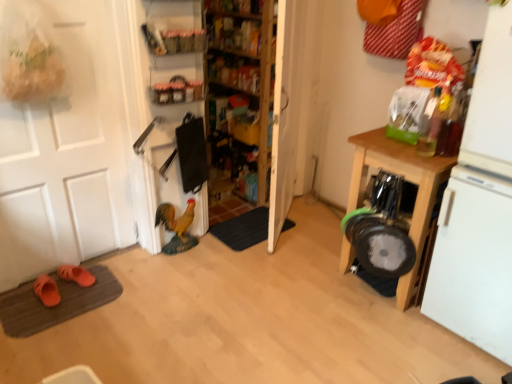
What are the coordinates of `brown textured doormat at lower left, positioned as the 2th doormat in back-to-front order` in the screenshot? It's located at (56, 305).

Image resolution: width=512 pixels, height=384 pixels. Describe the element at coordinates (177, 91) in the screenshot. I see `matte plastic shelf at upper center, which ranks as the second shelf in back-to-front order` at that location.

What do you see at coordinates (47, 290) in the screenshot? I see `orange rubber slippers at lower left, acting as the 2th footwear starting from the back` at bounding box center [47, 290].

Identify the location of wooden cutting board at right. The image size is (512, 384). (415, 198).

Which shelf is the 2nd one when counting from the right side of the matte plastic shelf at upper center, the 2th shelf when ordered from front to back? Please provide its 2D coordinates.

[(242, 87)]

Considering the relative positions of matte plastic shelf at upper center, the 2th shelf when ordered from front to back, and wooden shelves at center, which is the 1th shelf from back to front, in the image provided, is matte plastic shelf at upper center, the 2th shelf when ordered from front to back, in front of wooden shelves at center, which is the 1th shelf from back to front,?

Yes, matte plastic shelf at upper center, the 2th shelf when ordered from front to back, is in front of wooden shelves at center, which is the 1th shelf from back to front.

Does matte plastic shelf at upper center, which ranks as the second shelf in back-to-front order, turn towards wooden shelves at center, which is the third shelf from front to back?

No, matte plastic shelf at upper center, which ranks as the second shelf in back-to-front order, is not oriented towards wooden shelves at center, which is the third shelf from front to back.

Which of these two, matte plastic shelf at upper center, the 2th shelf when ordered from front to back, or wooden shelves at center, which is the 1th shelf from back to front, is wider?

wooden shelves at center, which is the 1th shelf from back to front.

What's the angular difference between white matte door at left and brown textured doormat at lower left, arranged as the 2th doormat when viewed from the top,'s facing directions?

The facing directions of white matte door at left and brown textured doormat at lower left, arranged as the 2th doormat when viewed from the top, are 0.6 degrees apart.

Locate an element on the screen. The width and height of the screenshot is (512, 384). door located in front of the brown textured doormat at lower left, arranged as the 2th doormat when viewed from the top is located at coordinates (67, 154).

Considering the relative positions of white matte door at left and brown textured doormat at lower left, positioned as the first doormat in front-to-back order, in the image provided, is white matte door at left to the left of brown textured doormat at lower left, positioned as the first doormat in front-to-back order, from the viewer's perspective?

Incorrect, white matte door at left is not on the left side of brown textured doormat at lower left, positioned as the first doormat in front-to-back order.

Is brown textured doormat at lower left, the 1th doormat when ordered from bottom to top, completely or partially inside white matte door at left?

No, brown textured doormat at lower left, the 1th doormat when ordered from bottom to top, is not a part of white matte door at left.

From a real-world perspective, which is physically above, wooden shelves at center, which is the 1th shelf from back to front, or brown textured doormat at lower left, which is the 1th doormat from left to right?

wooden shelves at center, which is the 1th shelf from back to front, from a real-world perspective.

Which object is more forward, wooden shelves at center, which is the third shelf from front to back, or brown textured doormat at lower left, positioned as the 2th doormat in back-to-front order?

brown textured doormat at lower left, positioned as the 2th doormat in back-to-front order, is in front.

Based on the photo, is wooden shelves at center, which is the 1th shelf from back to front, positioned far away from brown textured doormat at lower left, which is the 1th doormat from left to right?

wooden shelves at center, which is the 1th shelf from back to front, is positioned a significant distance from brown textured doormat at lower left, which is the 1th doormat from left to right.

What are the coordinates of `shelf that is the 1st object located above the brown textured doormat at lower left, positioned as the first doormat in front-to-back order (from the image's perspective)` in the screenshot? It's located at (242, 87).

Can we say white matte door at left lies outside orange rubber slippers at lower left, positioned as the first footwear in front-to-back order?

white matte door at left lies outside orange rubber slippers at lower left, positioned as the first footwear in front-to-back order,'s area.

Considering the positions of objects white matte door at left and orange rubber slippers at lower left, positioned as the first footwear in front-to-back order, in the image provided, who is more to the left, white matte door at left or orange rubber slippers at lower left, positioned as the first footwear in front-to-back order,?

orange rubber slippers at lower left, positioned as the first footwear in front-to-back order.

Considering the relative sizes of white matte door at left and orange rubber slippers at lower left, acting as the 2th footwear starting from the back, in the image provided, is white matte door at left taller than orange rubber slippers at lower left, acting as the 2th footwear starting from the back,?

Indeed, white matte door at left has a greater height compared to orange rubber slippers at lower left, acting as the 2th footwear starting from the back.

From a real-world perspective, does white matte door at left sit lower than orange rubber slippers at lower left, positioned as the first footwear in front-to-back order?

Actually, white matte door at left is physically above orange rubber slippers at lower left, positioned as the first footwear in front-to-back order, in the real world.

Based on the photo, which is more to the left, orange suede slippers at lower left, the 1th footwear viewed from the back, or white matte door at left?

white matte door at left is more to the left.

From the image's perspective, relative to white matte door at left, is orange suede slippers at lower left, which is the 2th footwear from front to back, above or below?

orange suede slippers at lower left, which is the 2th footwear from front to back, is situated lower than white matte door at left in the image.

From a real-world perspective, which footwear is the 2nd one underneath the white matte door at left? Please provide its 2D coordinates.

[(76, 274)]

Does wooden cutting board at right lie in front of white matte door at left?

No, it is behind white matte door at left.

Considering the relative positions of wooden cutting board at right and white matte door at left in the image provided, is wooden cutting board at right to the left or to the right of white matte door at left?

Based on their positions, wooden cutting board at right is located to the right of white matte door at left.

What are the coordinates of `cabinetry on the right of white matte door at left` in the screenshot? It's located at (415, 198).

Is there a large distance between wooden cutting board at right and white matte door at left?

Yes, wooden cutting board at right and white matte door at left are located far from each other.

Is dark gray carpet at center, which ranks as the second doormat in front-to-back order, at the right side of wooden shelves at center, which is the third shelf from front to back?

Incorrect, dark gray carpet at center, which ranks as the second doormat in front-to-back order, is not on the right side of wooden shelves at center, which is the third shelf from front to back.

Considering the sizes of objects dark gray carpet at center, which ranks as the second doormat in front-to-back order, and wooden shelves at center, which is the 1th shelf from back to front, in the image provided, who is taller, dark gray carpet at center, which ranks as the second doormat in front-to-back order, or wooden shelves at center, which is the 1th shelf from back to front,?

Standing taller between the two is wooden shelves at center, which is the 1th shelf from back to front.

Is dark gray carpet at center, marked as the first doormat in a right-to-left arrangement, aimed at wooden shelves at center, which is the third shelf from front to back?

No, dark gray carpet at center, marked as the first doormat in a right-to-left arrangement, is not aimed at wooden shelves at center, which is the third shelf from front to back.

Locate an element on the screen. This screenshot has width=512, height=384. the 1st shelf positioned above the wooden shelves at center, which is the 1th shelf from back to front (from a real-world perspective) is located at coordinates (177, 91).

You are a GUI agent. You are given a task and a screenshot of the screen. Output one action in this format:
    pyautogui.click(x=<x>, y=<y>)
    Task: Click on the door lying in front of the brown textured doormat at lower left, acting as the 2th doormat starting from the right
    The width and height of the screenshot is (512, 384).
    Given the screenshot: What is the action you would take?
    pyautogui.click(x=67, y=154)

Which object lies further to the anchor point orange rubber slippers at lower left, acting as the 2th footwear starting from the back, brown textured doormat at lower left, which is the 1th doormat from left to right, or wooden cutting board at right?

wooden cutting board at right lies further to orange rubber slippers at lower left, acting as the 2th footwear starting from the back, than the other object.

Considering their positions, is wooden cutting board at right positioned further to dark gray carpet at center, placed as the first doormat when sorted from back to front, than matte plastic shelf at upper center, which is counted as the 3th shelf, starting from the back?

The object further to dark gray carpet at center, placed as the first doormat when sorted from back to front, is matte plastic shelf at upper center, which is counted as the 3th shelf, starting from the back.

Which object lies nearer to the anchor point orange suede slippers at lower left, which is the 2th footwear from front to back, brown textured doormat at lower left, arranged as the 2th doormat when viewed from the top, or dark gray carpet at center, placed as the 2th doormat when sorted from bottom to top?

brown textured doormat at lower left, arranged as the 2th doormat when viewed from the top, is closer to orange suede slippers at lower left, which is the 2th footwear from front to back.

From the image, which object appears to be nearer to brown textured doormat at lower left, positioned as the first doormat in front-to-back order, dark gray carpet at center, which is the 2th doormat from left to right, or matte plastic shelf at upper center, which is counted as the 3th shelf, starting from the back?

dark gray carpet at center, which is the 2th doormat from left to right, is closer to brown textured doormat at lower left, positioned as the first doormat in front-to-back order.

Which object lies nearer to the anchor point dark gray carpet at center, placed as the 2th doormat when sorted from bottom to top, matte plastic shelf at upper center, which ranks as the first shelf in front-to-back order, or wooden shelves at center, which is the third shelf from front to back?

wooden shelves at center, which is the third shelf from front to back, lies closer to dark gray carpet at center, placed as the 2th doormat when sorted from bottom to top, than the other object.

Looking at the image, which one is located further to matte plastic shelf at upper center, which is counted as the 3th shelf, starting from the back, wooden cutting board at right or orange rubber slippers at lower left, acting as the 2th footwear starting from the back?

orange rubber slippers at lower left, acting as the 2th footwear starting from the back, lies further to matte plastic shelf at upper center, which is counted as the 3th shelf, starting from the back, than the other object.

Based on their spatial positions, is white matte door at left or wooden cutting board at right further from white matte refrigerator at right?

white matte door at left.

Looking at the image, which one is located further to white matte refrigerator at right, matte plastic shelf at upper center, which ranks as the first shelf in front-to-back order, or orange suede slippers at lower left, the 1th footwear viewed from the back?

Based on the image, orange suede slippers at lower left, the 1th footwear viewed from the back, appears to be further to white matte refrigerator at right.

I want to click on doormat located between brown textured doormat at lower left, the 1th doormat when ordered from bottom to top, and white matte refrigerator at right in the left-right direction, so click(243, 229).

You are a GUI agent. You are given a task and a screenshot of the screen. Output one action in this format:
    pyautogui.click(x=<x>, y=<y>)
    Task: Click on the doormat between orange suede slippers at lower left, which is the 2th footwear from front to back, and white matte refrigerator at right from left to right
    
    Given the screenshot: What is the action you would take?
    pyautogui.click(x=243, y=229)

This screenshot has width=512, height=384. I want to click on shelf between dark gray carpet at center, which ranks as the second doormat in front-to-back order, and white matte refrigerator at right, so point(242,87).

The width and height of the screenshot is (512, 384). I want to click on footwear between white matte door at left and dark gray carpet at center, placed as the 2th doormat when sorted from bottom to top, so click(x=76, y=274).